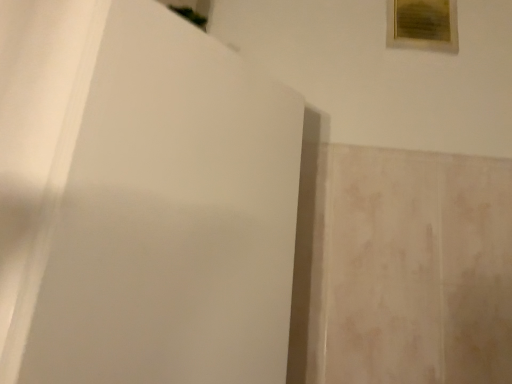
The image size is (512, 384). Describe the element at coordinates (141, 200) in the screenshot. I see `white matte screen door at center` at that location.

The height and width of the screenshot is (384, 512). Identify the location of white matte screen door at center. (141, 200).

Describe the element at coordinates (423, 25) in the screenshot. I see `wooden frame at upper right` at that location.

This screenshot has height=384, width=512. Identify the location of wooden frame at upper right. (423, 25).

You are a GUI agent. You are given a task and a screenshot of the screen. Output one action in this format:
    pyautogui.click(x=<x>, y=<y>)
    Task: Click on the white matte screen door at center
    
    Given the screenshot: What is the action you would take?
    pyautogui.click(x=141, y=200)

Which is more to the right, wooden frame at upper right or white matte screen door at center?

wooden frame at upper right is more to the right.

Relative to white matte screen door at center, is wooden frame at upper right in front or behind?

In the image, wooden frame at upper right appears behind white matte screen door at center.

Is point (445, 51) positioned after point (155, 143)?

Yes, it is behind point (155, 143).

From the image's perspective, who appears lower, wooden frame at upper right or white matte screen door at center?

white matte screen door at center.

From a real-world perspective, which is physically below, wooden frame at upper right or white matte screen door at center?

white matte screen door at center is physically lower.

Which object is thinner, wooden frame at upper right or white matte screen door at center?

With smaller width is wooden frame at upper right.

Between wooden frame at upper right and white matte screen door at center, which one has more height?

white matte screen door at center is taller.

Considering the sizes of wooden frame at upper right and white matte screen door at center in the image, is wooden frame at upper right bigger or smaller than white matte screen door at center?

In the image, wooden frame at upper right appears to be smaller than white matte screen door at center.

Is wooden frame at upper right spatially inside white matte screen door at center, or outside of it?

wooden frame at upper right cannot be found inside white matte screen door at center.

Can you see wooden frame at upper right touching white matte screen door at center?

There is a gap between wooden frame at upper right and white matte screen door at center.

Is wooden frame at upper right facing towards white matte screen door at center?

No, wooden frame at upper right is not turned towards white matte screen door at center.

At what (x,y) coordinates should I click in order to perform the action: click on screen door that is under the wooden frame at upper right (from a real-world perspective). Please return your answer as a coordinate pair (x, y). Looking at the image, I should click on (141, 200).

In the scene shown: Considering the positions of objects white matte screen door at center and wooden frame at upper right in the image provided, who is more to the left, white matte screen door at center or wooden frame at upper right?

white matte screen door at center is more to the left.

Between white matte screen door at center and wooden frame at upper right, which one is positioned in front?

white matte screen door at center is more forward.

Which is closer, (77,204) or (399,24)?

Clearly, point (77,204) is closer to the camera than point (399,24).

From the image's perspective, which object appears higher, white matte screen door at center or wooden frame at upper right?

wooden frame at upper right.

From a real-world perspective, who is located lower, white matte screen door at center or wooden frame at upper right?

In real-world perspective, white matte screen door at center is lower.

Is white matte screen door at center wider than wooden frame at upper right?

Yes.

Considering the sizes of white matte screen door at center and wooden frame at upper right in the image, is white matte screen door at center taller or shorter than wooden frame at upper right?

white matte screen door at center is taller than wooden frame at upper right.

Considering the sizes of objects white matte screen door at center and wooden frame at upper right in the image provided, who is bigger, white matte screen door at center or wooden frame at upper right?

With larger size is white matte screen door at center.

Looking at this image, is white matte screen door at center inside the boundaries of wooden frame at upper right, or outside?

white matte screen door at center is spatially situated outside wooden frame at upper right.

Is white matte screen door at center in contact with wooden frame at upper right?

No, white matte screen door at center is not with wooden frame at upper right.

Is white matte screen door at center turned away from wooden frame at upper right?

No, white matte screen door at center is not facing the opposite direction of wooden frame at upper right.

Where is `screen door on the left of the wooden frame at upper right`? The width and height of the screenshot is (512, 384). screen door on the left of the wooden frame at upper right is located at coordinates (141, 200).

Identify the location of picture frame above the white matte screen door at center (from the image's perspective). (423, 25).

Where is `picture frame located behind the white matte screen door at center`? picture frame located behind the white matte screen door at center is located at coordinates (423, 25).